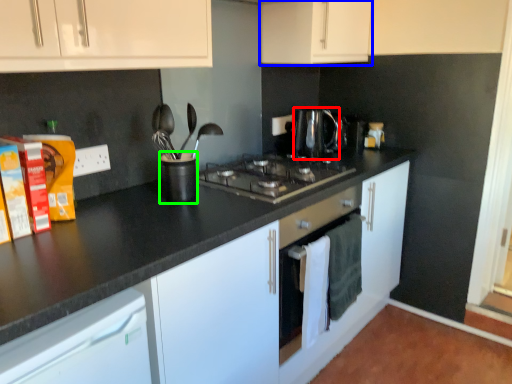
Question: Which object is positioned closest to kitchen appliance (highlighted by a red box)? Select from cabinetry (highlighted by a blue box) and appliance (highlighted by a green box).

Choices:
 (A) cabinetry
 (B) appliance

Answer: (A)